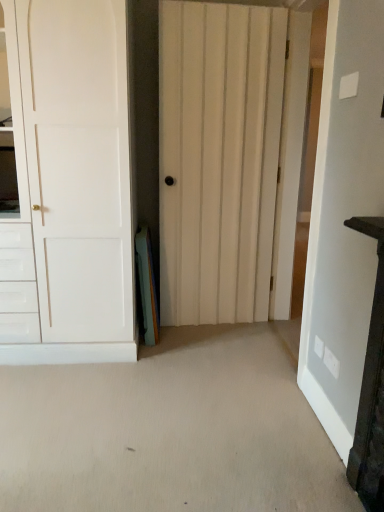
Identify the location of blank space above white wood door at center, which is the second door from right to left (from a real-world perspective). (244, 2).